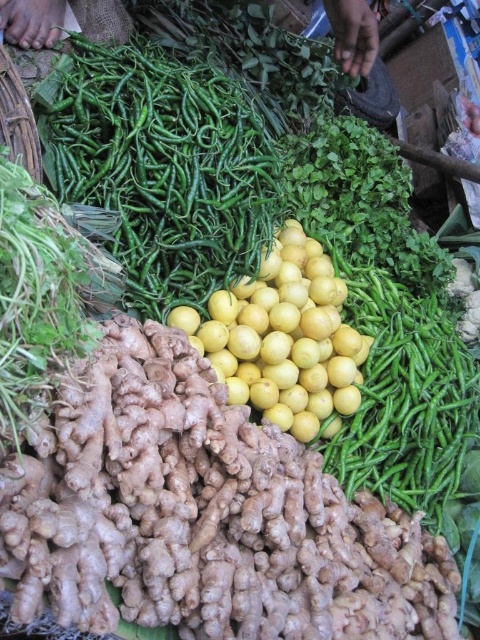
Question: Is green glossy chili peppers at upper center to the right of yellow matte lemon at center from the viewer's perspective?

Choices:
 (A) no
 (B) yes

Answer: (A)

Question: Is green glossy chili peppers at upper center above yellow matte lemon at center?

Choices:
 (A) no
 (B) yes

Answer: (B)

Question: Which object appears farthest from the camera in this image?

Choices:
 (A) green glossy chili peppers at upper center
 (B) yellow matte lemon at center

Answer: (B)

Question: In this image, where is green glossy chili peppers at upper center located relative to yellow matte lemon at center?

Choices:
 (A) below
 (B) above

Answer: (B)